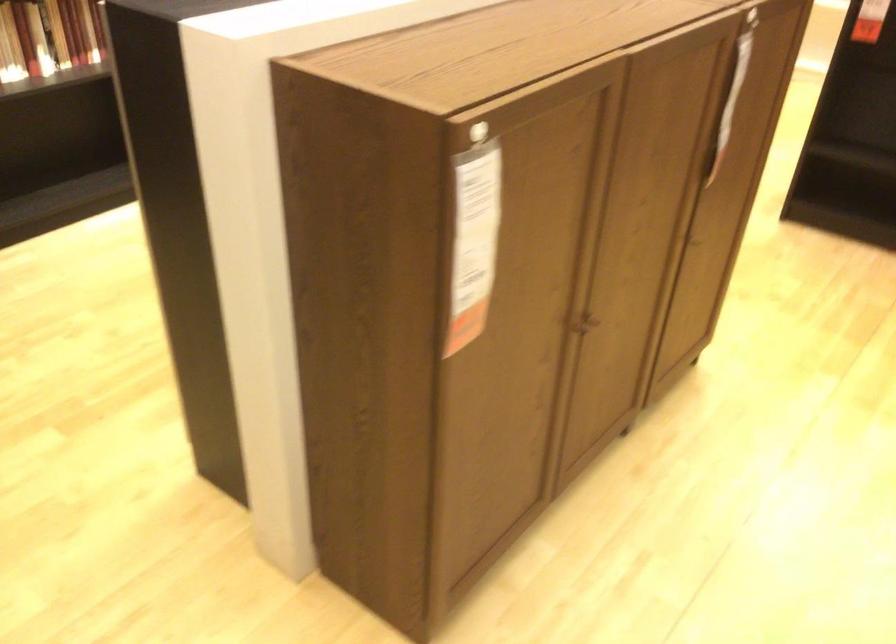
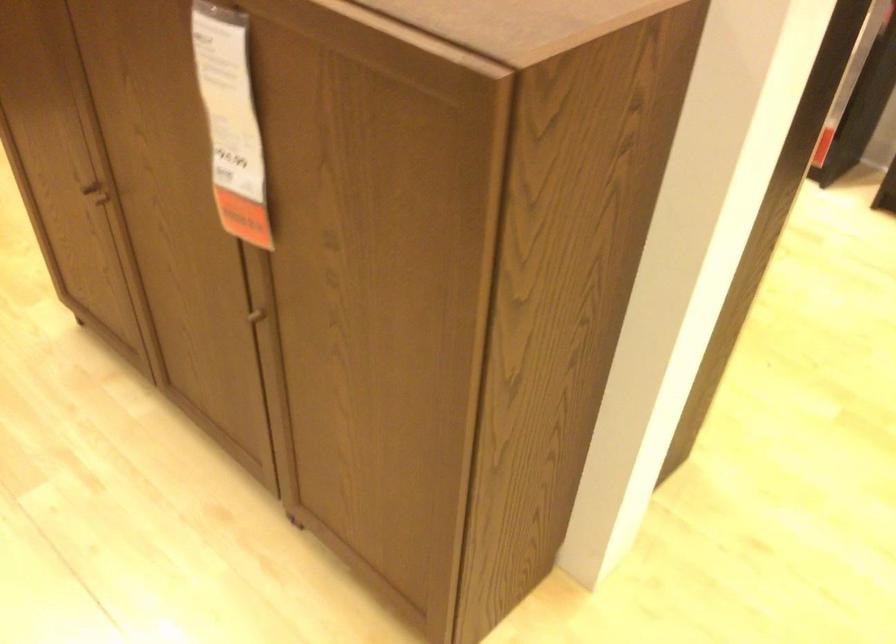
Find the pixel in the second image that matches pixel 581 337 in the first image.

(95, 196)